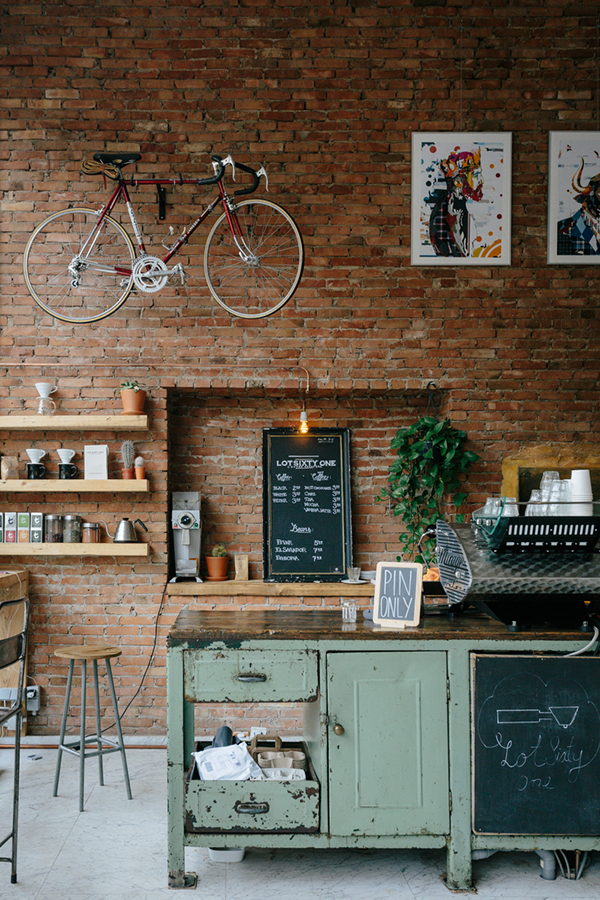
Locate an element on the screen. This screenshot has height=900, width=600. wall outlet is located at coordinates (32, 700).